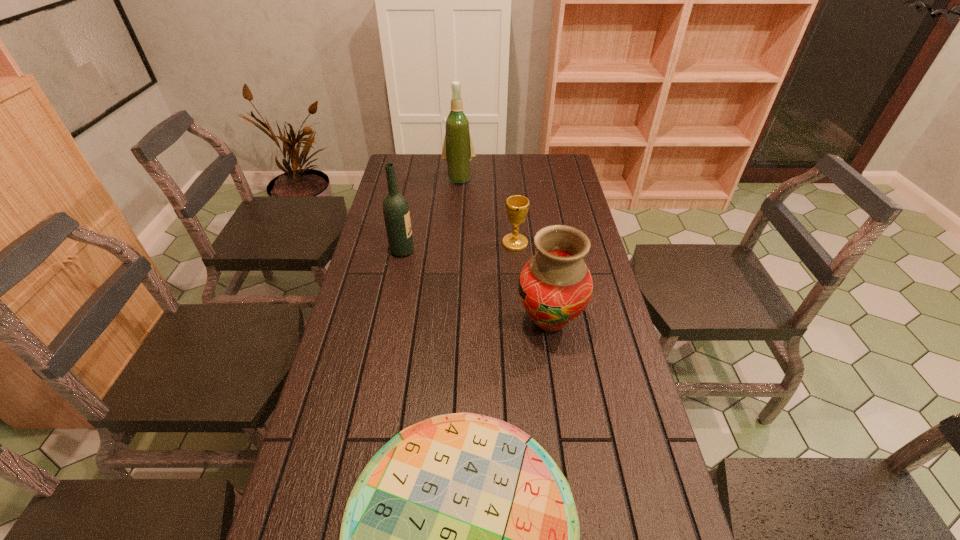
The width and height of the screenshot is (960, 540). In order to click on the taller wine bottle in this screenshot , I will do `click(458, 151)`.

Image resolution: width=960 pixels, height=540 pixels. Identify the location of the farthest object. (458, 151).

This screenshot has height=540, width=960. I want to click on the shorter wine bottle, so click(x=396, y=213).

Locate an element on the screen. the nearer wine bottle is located at coordinates (396, 213).

Find the location of a particular element. the fourth farthest object is located at coordinates (555, 286).

You are a GUI agent. You are given a task and a screenshot of the screen. Output one action in this format:
    pyautogui.click(x=<x>, y=<y>)
    Task: Click on the second shortest object
    This screenshot has width=960, height=540.
    Given the screenshot: What is the action you would take?
    pyautogui.click(x=517, y=206)

The image size is (960, 540). What are the coordinates of `vacant space situated on the front-facing side of the farthest object` in the screenshot? It's located at (457, 215).

Locate an element on the screen. This screenshot has width=960, height=540. vacant region located on the labeled side of the shorter wine bottle is located at coordinates click(x=500, y=251).

Locate an element on the screen. free space located on the front of the second nearest object is located at coordinates (561, 395).

Identify the location of vacant region located on the left of the chalice. (406, 243).